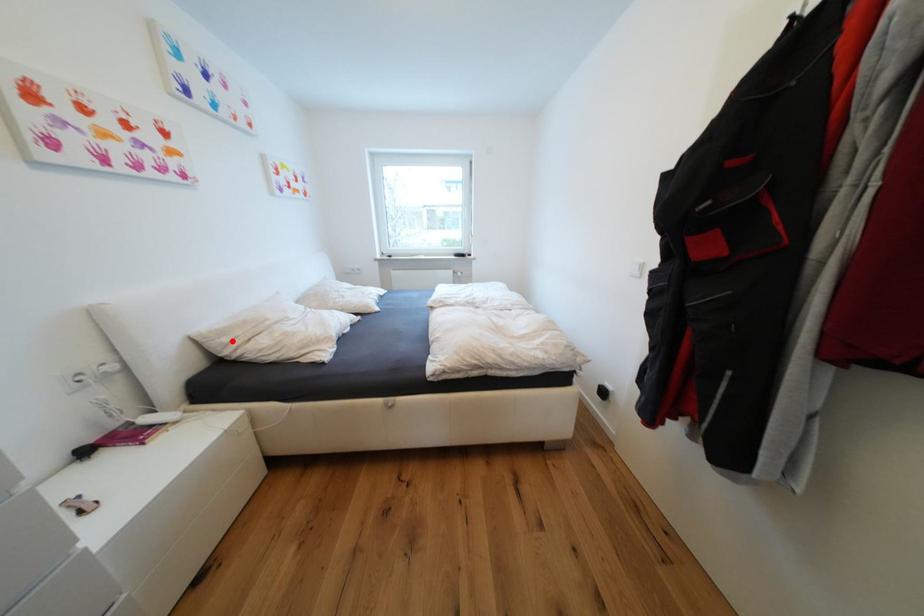
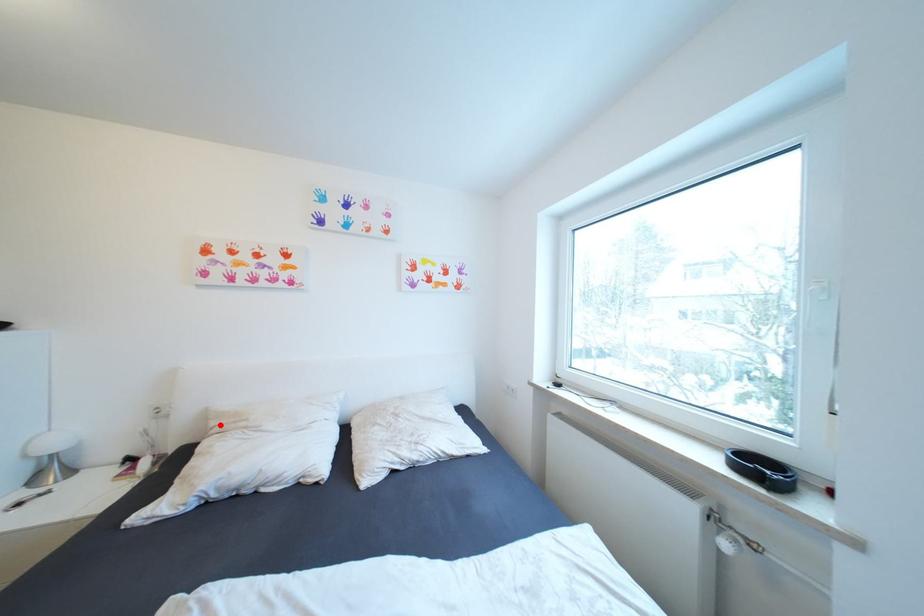
I am providing you with two images of the same scene from different viewpoints. A red point is marked on the first image and another point is marked on the second image. Are the points marked in image1 and image2 representing the same 3D position?

Yes